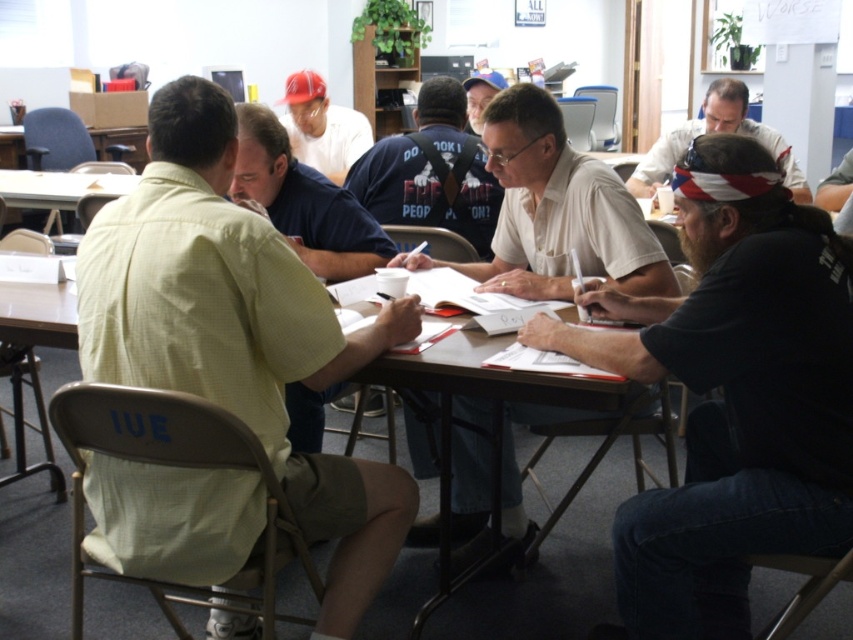
Is point (546, 458) positioned behind point (515, 288)?

Yes, it is.

Does wooden table at center appear under white paper at center?

Correct, wooden table at center is located below white paper at center.

Between point (563, 596) and point (518, 216), which one is positioned behind?

The point (518, 216) is behind.

I want to click on wooden table at center, so click(549, 573).

Which is more to the left, dark brown leather jacket at center or dark blue t-shirt at center?

dark blue t-shirt at center

Is dark brown leather jacket at center bigger than dark blue t-shirt at center?

Indeed, dark brown leather jacket at center has a larger size compared to dark blue t-shirt at center.

Is point (766, 330) farther from camera compared to point (474, 170)?

No, (766, 330) is closer to viewer.

Where is `dark brown leather jacket at center`? This screenshot has height=640, width=853. dark brown leather jacket at center is located at coordinates (732, 394).

The image size is (853, 640). What do you see at coordinates (238, 332) in the screenshot?
I see `light yellow shirt at left` at bounding box center [238, 332].

Does light yellow shirt at left appear over matte white shirt at upper center?

Incorrect, light yellow shirt at left is not positioned above matte white shirt at upper center.

Is point (270, 376) farther from viewer compared to point (316, 168)?

No.

Find the location of `light yellow shirt at left`. light yellow shirt at left is located at coordinates (238, 332).